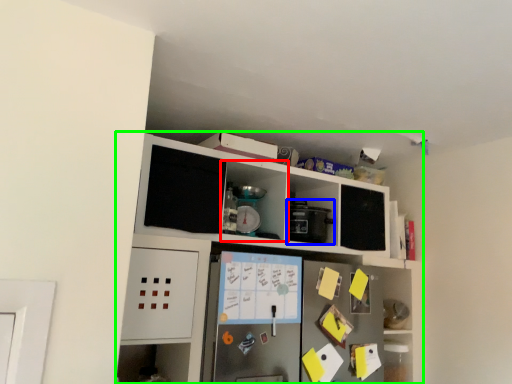
Question: Which object is the closest to the cabinet (highlighted by a red box)? Choose among these: appliance (highlighted by a blue box) or cabinetry (highlighted by a green box).

Choices:
 (A) appliance
 (B) cabinetry

Answer: (A)